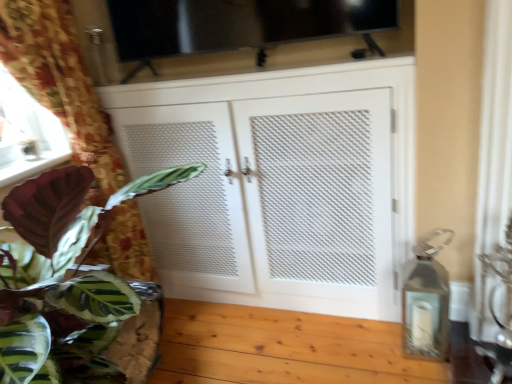
What do you see at coordinates (280, 184) in the screenshot? I see `white textured cabinet at center` at bounding box center [280, 184].

This screenshot has height=384, width=512. What do you see at coordinates (239, 23) in the screenshot?
I see `transparent glass window screen at upper center` at bounding box center [239, 23].

Describe the element at coordinates (32, 167) in the screenshot. This screenshot has height=384, width=512. I see `matte brown wood at lower left` at that location.

The width and height of the screenshot is (512, 384). Describe the element at coordinates (62, 275) in the screenshot. I see `green leafy plant at left` at that location.

At what (x,y) coordinates should I click in order to perform the action: click on white textured cabinet at center. Please return your answer as a coordinate pair (x, y). The height and width of the screenshot is (384, 512). Looking at the image, I should click on (280, 184).

Is transparent glass window screen at upper center outside of floral fabric curtain at left, marked as the 2th curtain in a right-to-left arrangement?

Yes, transparent glass window screen at upper center is located beyond the bounds of floral fabric curtain at left, marked as the 2th curtain in a right-to-left arrangement.

Looking at this image, between transparent glass window screen at upper center and floral fabric curtain at left, arranged as the 1th curtain when viewed from the left, which one has larger width?

Wider between the two is transparent glass window screen at upper center.

Does transparent glass window screen at upper center touch floral fabric curtain at left, arranged as the 1th curtain when viewed from the left?

No, transparent glass window screen at upper center is not with floral fabric curtain at left, arranged as the 1th curtain when viewed from the left.

Which is closer to the camera, (155, 41) or (42, 40)?

Clearly, point (155, 41) is more distant from the camera than point (42, 40).

In terms of width, does transparent glass window screen at upper center look wider or thinner when compared to white sheer curtain at right, which ranks as the second curtain in left-to-right order?

Clearly, transparent glass window screen at upper center has more width compared to white sheer curtain at right, which ranks as the second curtain in left-to-right order.

Is transparent glass window screen at upper center to the right of white sheer curtain at right, which is counted as the 1th curtain, starting from the right, from the viewer's perspective?

In fact, transparent glass window screen at upper center is to the left of white sheer curtain at right, which is counted as the 1th curtain, starting from the right.

Is transparent glass window screen at upper center touching white sheer curtain at right, which ranks as the second curtain in left-to-right order?

No, transparent glass window screen at upper center is not next to white sheer curtain at right, which ranks as the second curtain in left-to-right order.

Find the location of a particular element. The width and height of the screenshot is (512, 384). curtain on the right of transparent glass window screen at upper center is located at coordinates (493, 158).

From a real-world perspective, which object stands above the other?

white sheer curtain at right, which ranks as the second curtain in left-to-right order.

Is white sheer curtain at right, which ranks as the second curtain in left-to-right order, inside the boundaries of green leafy plant at left, or outside?

white sheer curtain at right, which ranks as the second curtain in left-to-right order, is outside green leafy plant at left.

Can you confirm if green leafy plant at left is wider than white sheer curtain at right, which is counted as the 1th curtain, starting from the right?

Yes, green leafy plant at left is wider than white sheer curtain at right, which is counted as the 1th curtain, starting from the right.

Where is `houseplant in front of the white sheer curtain at right, which is counted as the 1th curtain, starting from the right`? houseplant in front of the white sheer curtain at right, which is counted as the 1th curtain, starting from the right is located at coordinates (62, 275).

From a real-world perspective, which is physically above, green leafy plant at left or white sheer curtain at right, which is counted as the 1th curtain, starting from the right?

white sheer curtain at right, which is counted as the 1th curtain, starting from the right, is physically above.

Which curtain is the 1st one when counting from the front of the white textured cabinet at center? Please provide its 2D coordinates.

[(493, 158)]

Is white sheer curtain at right, which ranks as the second curtain in left-to-right order, facing towards white textured cabinet at center?

No.

Looking at this image, which object is positioned more to the left, white sheer curtain at right, which is counted as the 1th curtain, starting from the right, or white textured cabinet at center?

white textured cabinet at center.

From the image's perspective, which object appears higher, white sheer curtain at right, which is counted as the 1th curtain, starting from the right, or white textured cabinet at center?

white sheer curtain at right, which is counted as the 1th curtain, starting from the right, is shown above in the image.

Which object is closer to the camera, green leafy plant at left or white textured cabinet at center?

green leafy plant at left is in front.

Between point (115, 308) and point (412, 140), which one is positioned behind?

The point (412, 140) is more distant.

Does green leafy plant at left have a larger size compared to white textured cabinet at center?

No.

From the image's perspective, is green leafy plant at left over white textured cabinet at center?

No.

From a real-world perspective, who is located lower, white textured cabinet at center or green leafy plant at left?

white textured cabinet at center is physically lower.

Based on the photo, from the image's perspective, is white textured cabinet at center below green leafy plant at left?

Actually, white textured cabinet at center appears above green leafy plant at left in the image.

Based on the photo, is white textured cabinet at center bigger than green leafy plant at left?

Indeed, white textured cabinet at center has a larger size compared to green leafy plant at left.

Which object is thinner, white textured cabinet at center or green leafy plant at left?

white textured cabinet at center is thinner.

Find the location of a particular element. The image size is (512, 384). window screen that is behind the floral fabric curtain at left, arranged as the 1th curtain when viewed from the left is located at coordinates (239, 23).

You are a GUI agent. You are given a task and a screenshot of the screen. Output one action in this format:
    pyautogui.click(x=<x>, y=<y>)
    Task: Click on the window screen on the left side of white sheer curtain at right, which ranks as the second curtain in left-to-right order
    The width and height of the screenshot is (512, 384).
    Given the screenshot: What is the action you would take?
    (x=239, y=23)

Considering their positions, is floral fabric curtain at left, arranged as the 1th curtain when viewed from the left, positioned further to white sheer curtain at right, which is counted as the 1th curtain, starting from the right, than transparent glass window screen at upper center?

Based on the image, floral fabric curtain at left, arranged as the 1th curtain when viewed from the left, appears to be further to white sheer curtain at right, which is counted as the 1th curtain, starting from the right.

When comparing their distances from transparent glass window screen at upper center, does green leafy plant at left or white sheer curtain at right, which ranks as the second curtain in left-to-right order, seem further?

Based on the image, green leafy plant at left appears to be further to transparent glass window screen at upper center.

When comparing their distances from white sheer curtain at right, which ranks as the second curtain in left-to-right order, does floral fabric curtain at left, marked as the 2th curtain in a right-to-left arrangement, or green leafy plant at left seem closer?

green leafy plant at left lies closer to white sheer curtain at right, which ranks as the second curtain in left-to-right order, than the other object.

From the image, which object appears to be nearer to matte brown wood at lower left, green leafy plant at left or transparent glass window screen at upper center?

green leafy plant at left.

Estimate the real-world distances between objects in this image. Which object is further from green leafy plant at left, matte brown wood at lower left or white sheer curtain at right, which ranks as the second curtain in left-to-right order?

white sheer curtain at right, which ranks as the second curtain in left-to-right order.

From the image, which object appears to be nearer to transparent glass window screen at upper center, matte brown wood at lower left or white textured cabinet at center?

white textured cabinet at center.

From the picture: Estimate the real-world distances between objects in this image. Which object is closer to matte brown wood at lower left, white sheer curtain at right, which is counted as the 1th curtain, starting from the right, or floral fabric curtain at left, marked as the 2th curtain in a right-to-left arrangement?

floral fabric curtain at left, marked as the 2th curtain in a right-to-left arrangement, is positioned closer to the anchor matte brown wood at lower left.

Looking at the image, which one is located further to matte brown wood at lower left, green leafy plant at left or white textured cabinet at center?

white textured cabinet at center.

In order to click on cupboard between green leafy plant at left and matte brown wood at lower left from front to back in this screenshot , I will do `click(280, 184)`.

Where is `cupboard between green leafy plant at left and white sheer curtain at right, which ranks as the second curtain in left-to-right order, in the horizontal direction`? cupboard between green leafy plant at left and white sheer curtain at right, which ranks as the second curtain in left-to-right order, in the horizontal direction is located at coordinates [280, 184].

At what (x,y) coordinates should I click in order to perform the action: click on curtain between matte brown wood at lower left and white sheer curtain at right, which is counted as the 1th curtain, starting from the right, in the horizontal direction. Please return your answer as a coordinate pair (x, y). Looking at the image, I should click on coord(61,84).

The height and width of the screenshot is (384, 512). What are the coordinates of `window screen between matte brown wood at lower left and white textured cabinet at center` in the screenshot? It's located at coord(239,23).